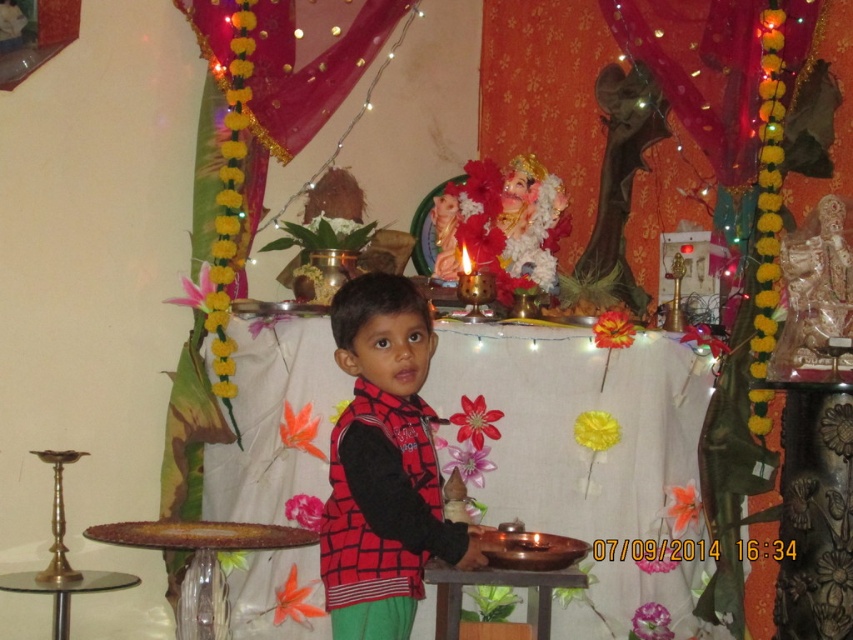
You are a guest at this celebration and want to place a flower offering on the shiny brass tray at center. Can you estimate the tray position relative to the wall with the drapes?

The shiny brass tray at center is located at point 0.714 on the horizontal axis and 0.683 on the vertical axis, so it is positioned to the right and lower down in the scene relative to the wall with the drapes.